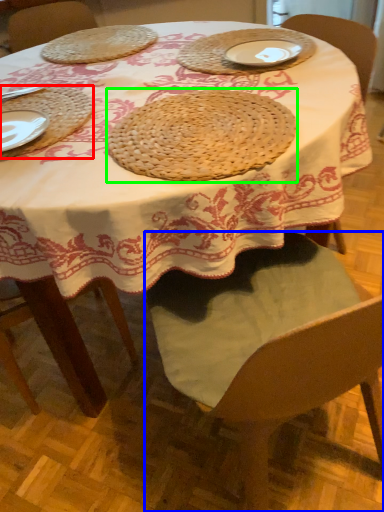
Question: Estimate the real-world distances between objects in this image. Which object is farther from tray (highlighted by a red box), chair (highlighted by a blue box) or pie (highlighted by a green box)?

Choices:
 (A) chair
 (B) pie

Answer: (A)